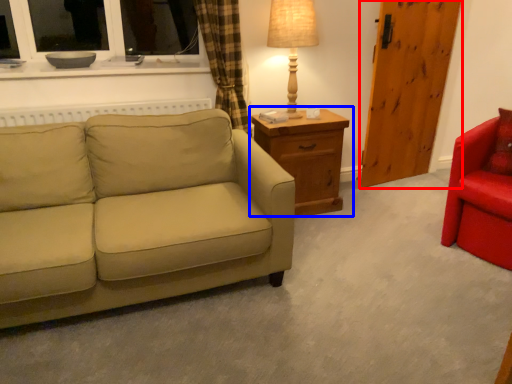
Question: Which point is further to the camera, barn door (highlighted by a red box) or nightstand (highlighted by a blue box)?

Choices:
 (A) barn door
 (B) nightstand

Answer: (A)